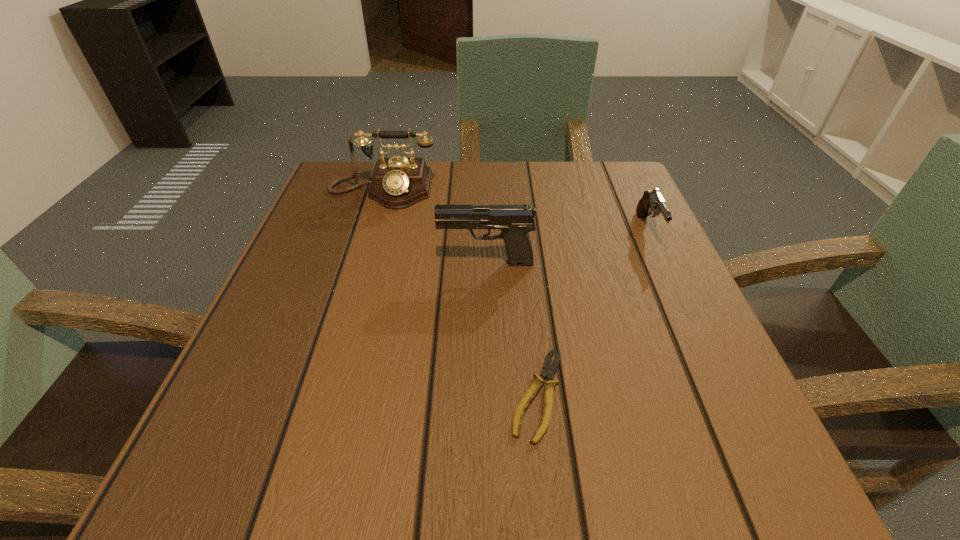
Where is `telephone`? The image size is (960, 540). telephone is located at coordinates (398, 182).

Where is `the leftmost object`? the leftmost object is located at coordinates (398, 182).

At what (x,y) coordinates should I click in order to perform the action: click on the third farthest object. Please return your answer as a coordinate pair (x, y). The image size is (960, 540). Looking at the image, I should click on (515, 221).

You are a GUI agent. You are given a task and a screenshot of the screen. Output one action in this format:
    pyautogui.click(x=<x>, y=<y>)
    Task: Click on the nearer pistol
    The width and height of the screenshot is (960, 540).
    Given the screenshot: What is the action you would take?
    pyautogui.click(x=515, y=221)

Locate an element on the screen. The image size is (960, 540). the rightmost object is located at coordinates (652, 201).

Identify the location of the third tallest object. (652, 201).

Locate an element on the screen. pliers is located at coordinates (549, 370).

This screenshot has height=540, width=960. I want to click on the shortest object, so click(x=549, y=370).

You are a GUI agent. You are given a task and a screenshot of the screen. Output one action in this format:
    pyautogui.click(x=<x>, y=<y>)
    Task: Click on the free point located 0.230m on the dial of the telephone
    This screenshot has width=960, height=540.
    Given the screenshot: What is the action you would take?
    pyautogui.click(x=355, y=283)

Find the location of a particular element. This screenshot has height=540, width=960. vacant space located aim along the barrel of the nearer pistol is located at coordinates (300, 263).